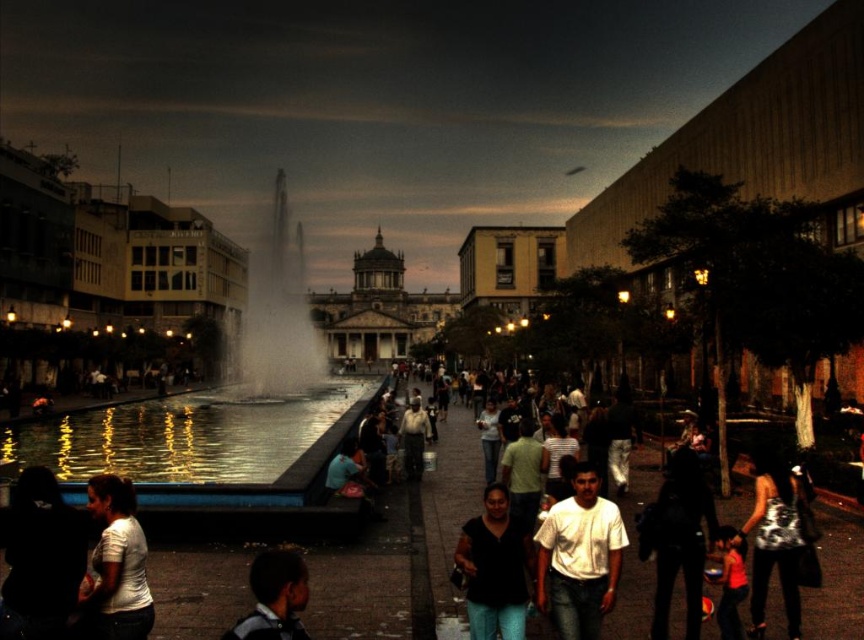
Can you confirm if white matte shirt at lower left is taller than dark skin human head at lower center?

Yes.

Locate an element on the screen. The image size is (864, 640). white matte shirt at lower left is located at coordinates (116, 564).

Does reflective glass water at center left lie behind white matte shirt at lower left?

Yes, reflective glass water at center left is behind white matte shirt at lower left.

Can you confirm if reflective glass water at center left is taller than white matte shirt at lower left?

Indeed, reflective glass water at center left has a greater height compared to white matte shirt at lower left.

From the picture: Who is more forward, (x=183, y=332) or (x=113, y=486)?

Point (x=113, y=486) is more forward.

Where is `reflective glass water at center left`? reflective glass water at center left is located at coordinates (175, 365).

Between reflective glass waterway at center and shiny silver tank top at lower right, which one has more height?

shiny silver tank top at lower right

Who is more distant from viewer, (238, 413) or (791, 570)?

Positioned behind is point (238, 413).

Locate an element on the screen. reflective glass waterway at center is located at coordinates (185, 435).